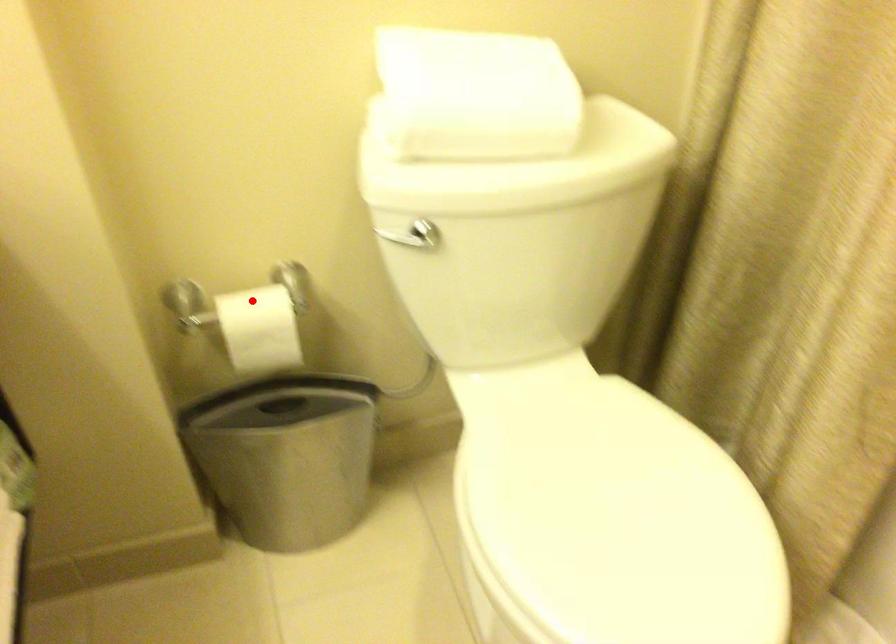
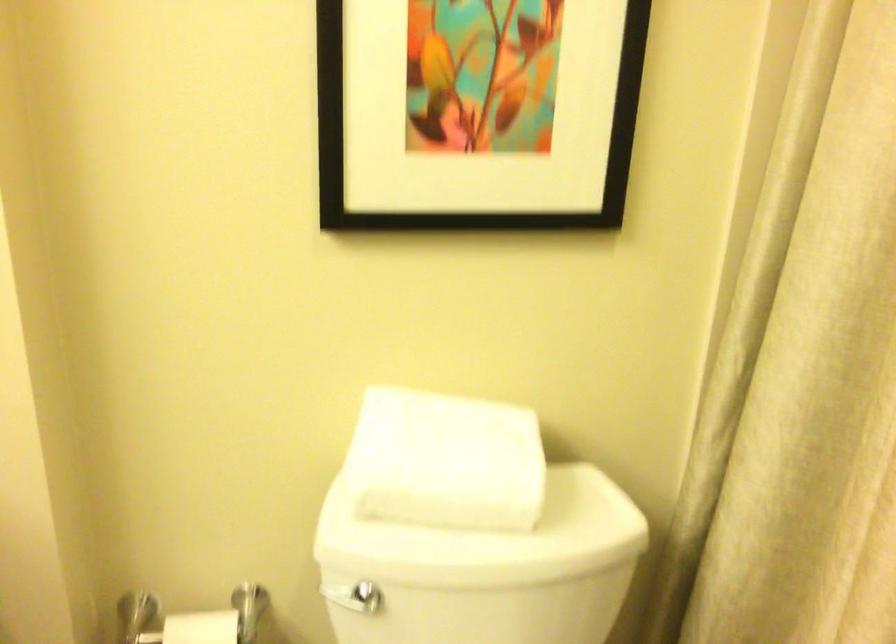
The point at the highlighted location is marked in the first image. Where is the corresponding point in the second image?

(201, 627)